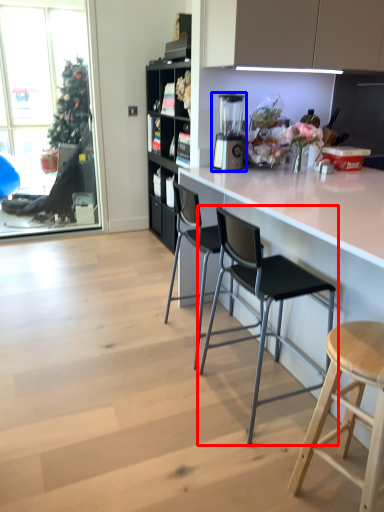
Question: Which object appears closest to the camera in this image, chair (highlighted by a red box) or appliance (highlighted by a blue box)?

Choices:
 (A) chair
 (B) appliance

Answer: (A)